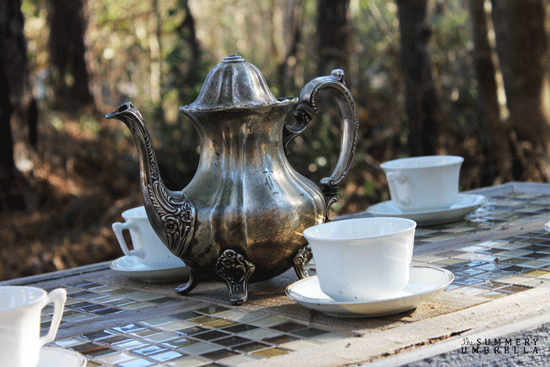
Find the location of a particular element. The image size is (550, 367). cup handle is located at coordinates (138, 247).